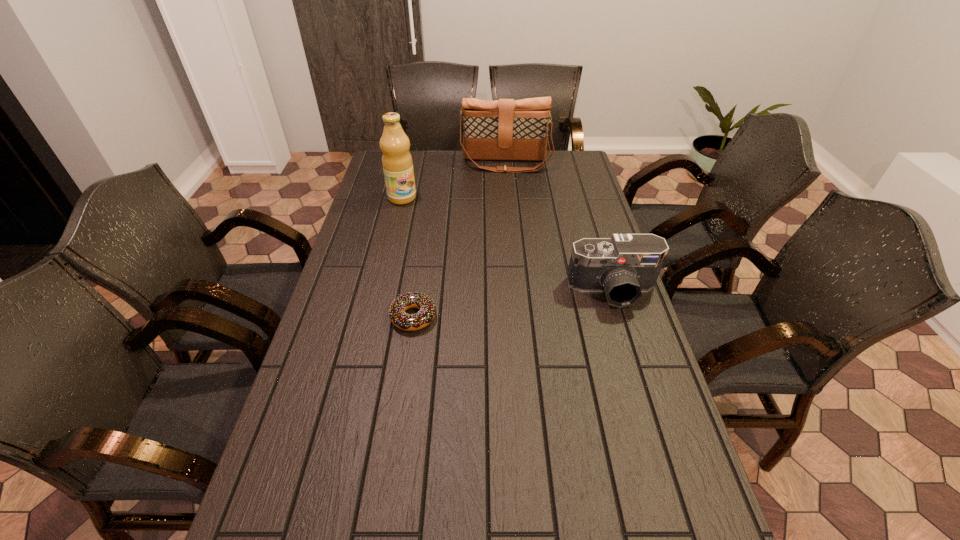
In order to click on the shortest object in this screenshot , I will do `click(402, 320)`.

Identify the location of the second shortest object. The height and width of the screenshot is (540, 960). (623, 266).

Identify the location of shoulder bag. Image resolution: width=960 pixels, height=540 pixels. (506, 129).

I want to click on the farthest object, so click(506, 129).

The height and width of the screenshot is (540, 960). I want to click on the tallest object, so [397, 163].

Find the location of a particular element. The width and height of the screenshot is (960, 540). olive oil is located at coordinates (397, 163).

The width and height of the screenshot is (960, 540). Find the location of `vacant space located 0.260m on the back of the doughnut`. vacant space located 0.260m on the back of the doughnut is located at coordinates (424, 245).

The height and width of the screenshot is (540, 960). I want to click on vacant space located 0.310m on the front-facing side of the second shortest object, so click(649, 406).

Locate an element on the screen. The width and height of the screenshot is (960, 540). vacant space located on the front-facing side of the farthest object is located at coordinates (506, 229).

Identify the location of free space located on the front-facing side of the farthest object. The height and width of the screenshot is (540, 960). (505, 188).